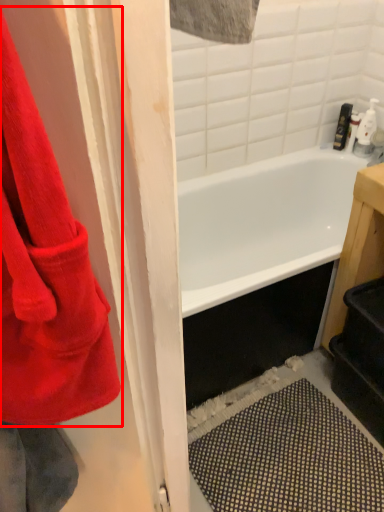
Question: In this image, where is towel (annotated by the red box) located relative to toiletry?

Choices:
 (A) left
 (B) right

Answer: (A)